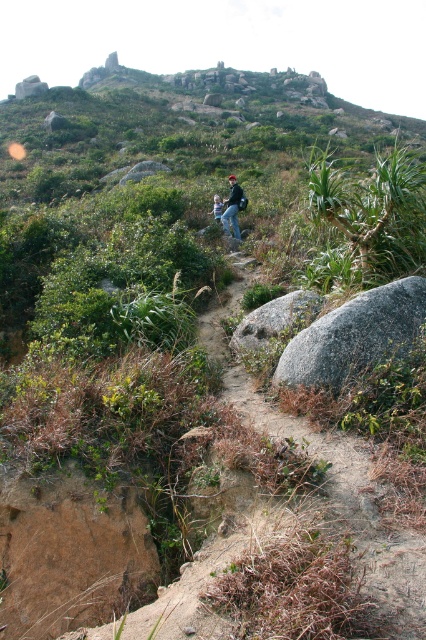
You are a hiker carrying a backpack and see the gray granite rock at center and the blue jeans at center on the path. Which object takes up more horizontal space on the path?

The gray granite rock at center might be wider than blue jeans at center, so it likely occupies more horizontal space on the path.

You are a hiker standing at the starting point of the trail. You see the dirt path at center and the blue jeans at center. How far apart are these two landmarks from each other?

The dirt path at center is 10.84 meters away from the blue jeans at center.

You are a hiker who has just spotted both the gray granite rock at center and the blue jeans at center on the hiking trail. According to the scene, which object is located lower in elevation?

The gray granite rock at center is positioned under blue jeans at center, so the gray granite rock at center is lower in elevation.